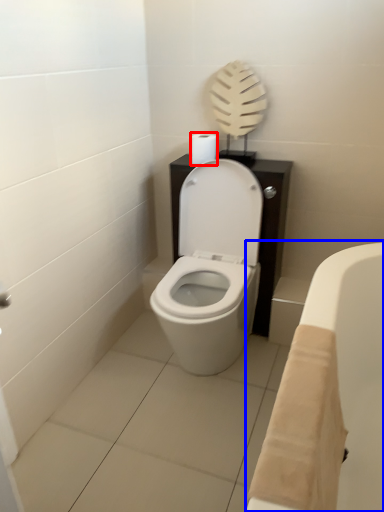
Question: Which point is further to the camera, toilet paper (highlighted by a red box) or bath (highlighted by a blue box)?

Choices:
 (A) toilet paper
 (B) bath

Answer: (A)